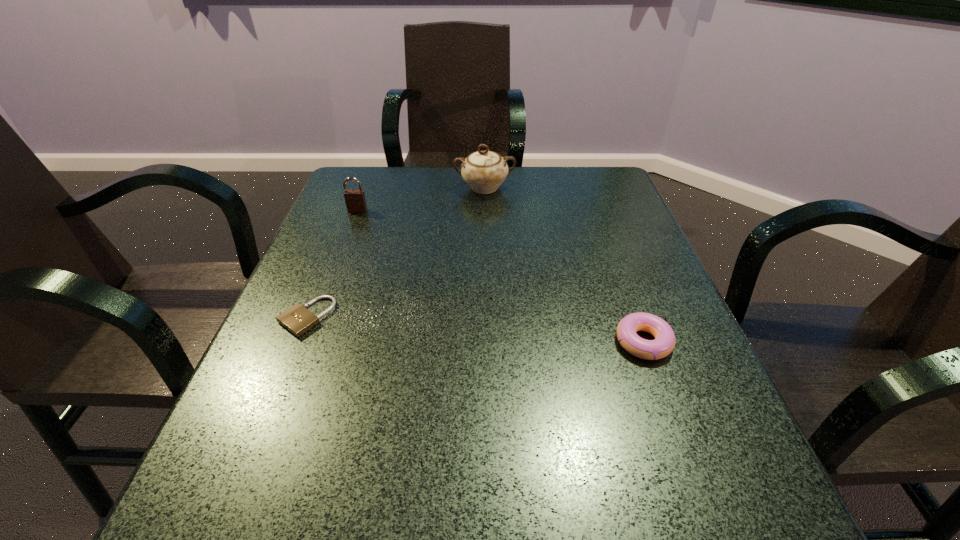
This screenshot has width=960, height=540. Find the location of `vacant space located 0.130m on the front of the rightmost object`. vacant space located 0.130m on the front of the rightmost object is located at coordinates (678, 435).

Identify the location of vacant space located 0.210m on the right of the nearer padlock. Image resolution: width=960 pixels, height=540 pixels. (444, 317).

Locate an element on the screen. chinaware that is positioned at the far edge is located at coordinates (484, 171).

Where is `padlock that is at the far edge`? The width and height of the screenshot is (960, 540). padlock that is at the far edge is located at coordinates (355, 200).

Image resolution: width=960 pixels, height=540 pixels. In order to click on object that is at the right edge in this screenshot , I will do `click(664, 343)`.

Image resolution: width=960 pixels, height=540 pixels. I want to click on object that is at the far left corner, so click(355, 200).

Identify the location of free space at the far edge. [x=413, y=174].

Where is `free region at the near edge of the desktop`? The width and height of the screenshot is (960, 540). free region at the near edge of the desktop is located at coordinates (594, 487).

The image size is (960, 540). Find the location of `free space at the left edge`. free space at the left edge is located at coordinates (320, 354).

What are the coordinates of `free space at the right edge of the desktop` in the screenshot? It's located at (600, 226).